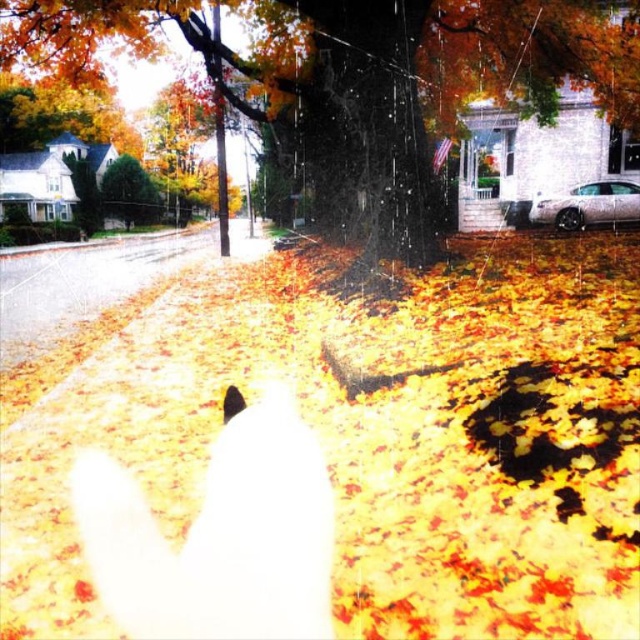
You are standing at the edge of the residential street looking towards the house with the American flag. There is a point marked at coordinates (364, 81). What object does this point correspond to?

The point at coordinates (364, 81) corresponds to the smooth bark tree at center.

You are standing on the residential street and want to take a photo of the smooth bark tree at center without the green textured bush at upper left blocking the view. Which direction should you move to ensure the bush is out of frame?

Move to the right side of the street, away from the green textured bush at upper left, so that the smooth bark tree at center is framed without the bush obstructing the view.